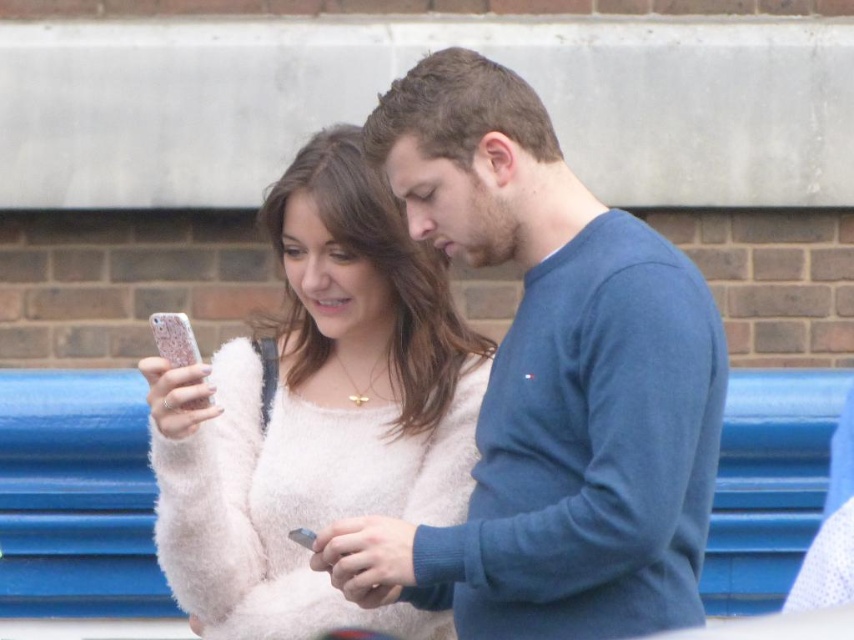
You are a fashion designer observing two people wearing sweaters in the scene. The blue cotton sweater at center and the fuzzy white sweater at center. Which sweater is closer to you?

The blue cotton sweater at center is closer to you because it is in front of the fuzzy white sweater at center.

You are taking a photo of two people in the scene. You want to focus on the person at point (542, 589) and the person at point (319, 156). Which person will be in focus if you focus on the closer one?

Point (542, 589) is closer to the camera than point (319, 156), so the person at point (542, 589) will be in focus.

You are standing in front of the scene described. Which direction should you move to get closer to the blue cotton sweater at center?

The blue cotton sweater at center is located at point (550, 385) in the image coordinates, so you should move towards the center of the image to get closer to it.